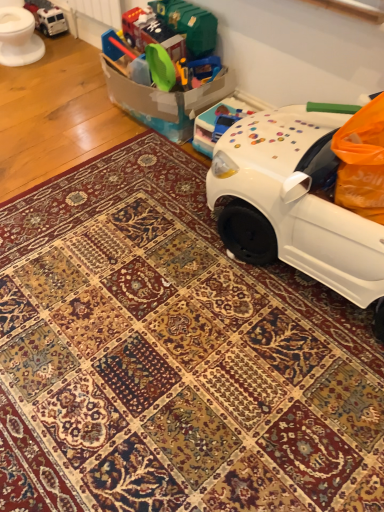
Find the location of a particular element. The width and height of the screenshot is (384, 512). unoccupied region to the right of white glossy toilet bowl at upper left is located at coordinates (64, 57).